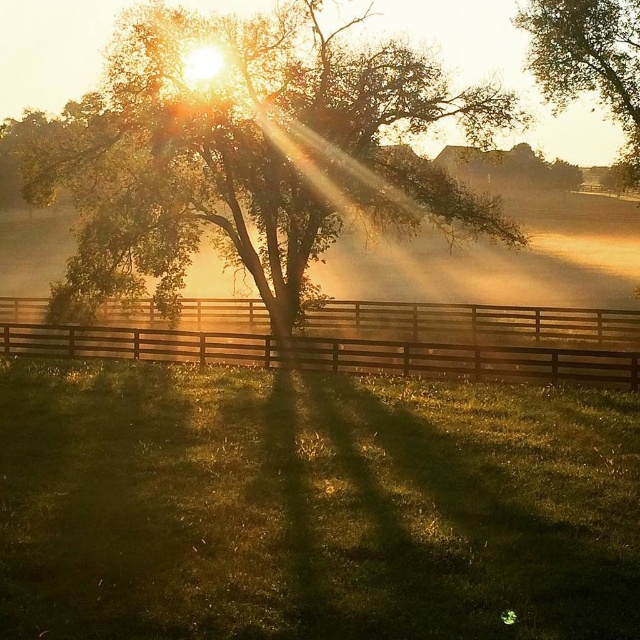
Between point (177, 156) and point (189, 330), which one is positioned in front?

Positioned in front is point (177, 156).

Which is below, green leafy tree at center or brown wooden fence at center?

brown wooden fence at center is lower down.

Describe the element at coordinates (248, 154) in the screenshot. I see `green leafy tree at center` at that location.

The width and height of the screenshot is (640, 640). Identify the location of green leafy tree at center. [248, 154].

Who is higher up, brown wooden fence at center or smooth green tree at upper right?

smooth green tree at upper right

The height and width of the screenshot is (640, 640). What do you see at coordinates (476, 340) in the screenshot?
I see `brown wooden fence at center` at bounding box center [476, 340].

At what (x,y) coordinates should I click in order to perform the action: click on brown wooden fence at center. Please return your answer as a coordinate pair (x, y). Looking at the image, I should click on (476, 340).

Which is above, smooth green tree at upper right or smooth brown tree at upper center?

smooth brown tree at upper center is higher up.

Who is more forward, (598, 13) or (524, 182)?

Point (598, 13) is more forward.

Identify the location of smooth green tree at upper right. (588, 60).